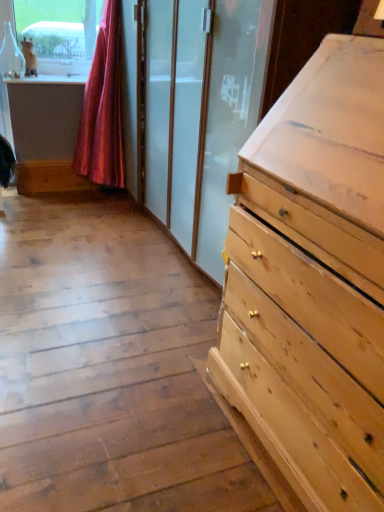
Question: From a real-world perspective, is white fur cat at upper left above or below silky pink curtain at upper left?

Choices:
 (A) below
 (B) above

Answer: (B)

Question: Does point (34, 66) appear closer or farther from the camera than point (109, 136)?

Choices:
 (A) farther
 (B) closer

Answer: (B)

Question: In the image, is white fur cat at upper left on the left side or the right side of silky pink curtain at upper left?

Choices:
 (A) left
 (B) right

Answer: (A)

Question: In the image, is silky pink curtain at upper left on the left side or the right side of white fur cat at upper left?

Choices:
 (A) right
 (B) left

Answer: (A)

Question: Is silky pink curtain at upper left bigger or smaller than white fur cat at upper left?

Choices:
 (A) small
 (B) big

Answer: (B)

Question: Is silky pink curtain at upper left wider or thinner than white fur cat at upper left?

Choices:
 (A) thin
 (B) wide

Answer: (B)

Question: Considering the positions of point (91, 81) and point (34, 54), is point (91, 81) closer or farther from the camera than point (34, 54)?

Choices:
 (A) closer
 (B) farther

Answer: (A)